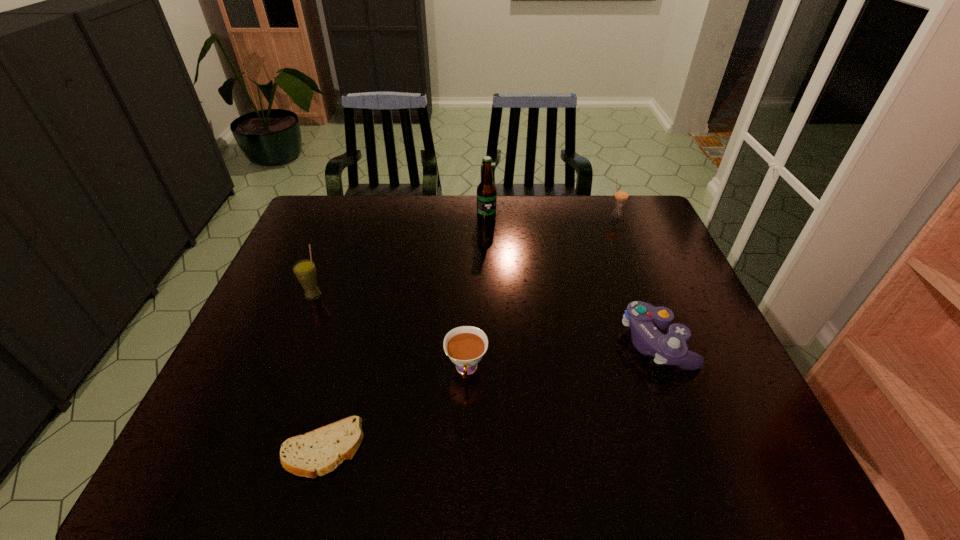
Locate an element on the screen. The height and width of the screenshot is (540, 960). vacant region located on the right of the second tallest object is located at coordinates (438, 295).

The width and height of the screenshot is (960, 540). I want to click on vacant region located 0.300m on the left of the shorter straw, so click(x=522, y=217).

Where is `vacant space located 0.140m on the left of the control`? The width and height of the screenshot is (960, 540). vacant space located 0.140m on the left of the control is located at coordinates (566, 342).

Locate an element on the screen. vacant area situated on the side of the teacup with the handle is located at coordinates (466, 409).

Identify the location of free space located 0.050m on the right of the fifth object from right to left. The width and height of the screenshot is (960, 540). (386, 449).

Image resolution: width=960 pixels, height=540 pixels. I want to click on beer bottle that is at the far edge, so click(486, 191).

Where is `straw situated at the far edge`? The width and height of the screenshot is (960, 540). straw situated at the far edge is located at coordinates (621, 194).

Locate an element on the screen. This screenshot has height=540, width=960. object that is at the near edge is located at coordinates point(318,452).

The image size is (960, 540). Find the location of `object positioned at the left edge`. object positioned at the left edge is located at coordinates (305, 271).

Identify the location of straw that is at the right edge. The width and height of the screenshot is (960, 540). (621, 194).